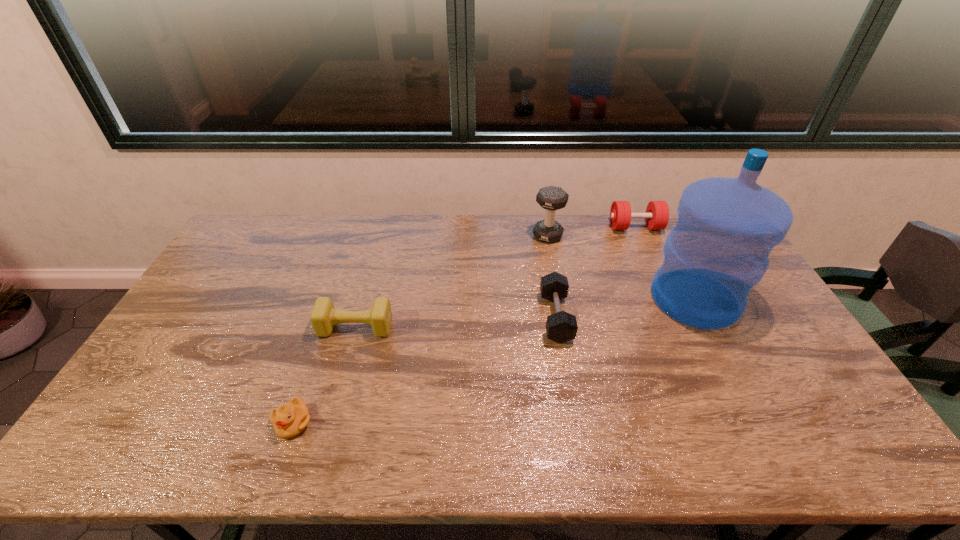
This screenshot has width=960, height=540. Identify the location of object positioned at the near edge. (290, 419).

Locate an element on the screen. object at the right edge is located at coordinates (719, 249).

Locate an element on the screen. The image size is (960, 540). vacant space at the far edge of the desktop is located at coordinates (497, 221).

In the image, there is a desktop. Identify the location of blank space at the left edge. The width and height of the screenshot is (960, 540). (211, 294).

Where is `free space at the right edge of the desktop`? The height and width of the screenshot is (540, 960). free space at the right edge of the desktop is located at coordinates (744, 324).

The height and width of the screenshot is (540, 960). Find the location of `vacant space at the near left corner of the desktop`. vacant space at the near left corner of the desktop is located at coordinates click(x=132, y=428).

This screenshot has height=540, width=960. I want to click on free space between the rightmost dumbbell and the shortest object, so click(465, 325).

Find the location of a particular element. This screenshot has width=960, height=540. vacant area that lies between the shortest object and the leftmost dumbbell is located at coordinates (324, 375).

The width and height of the screenshot is (960, 540). I want to click on unoccupied position between the tallest object and the leftmost dumbbell, so click(525, 313).

The width and height of the screenshot is (960, 540). I want to click on unoccupied position between the fifth shortest object and the rightmost dumbbell, so click(591, 232).